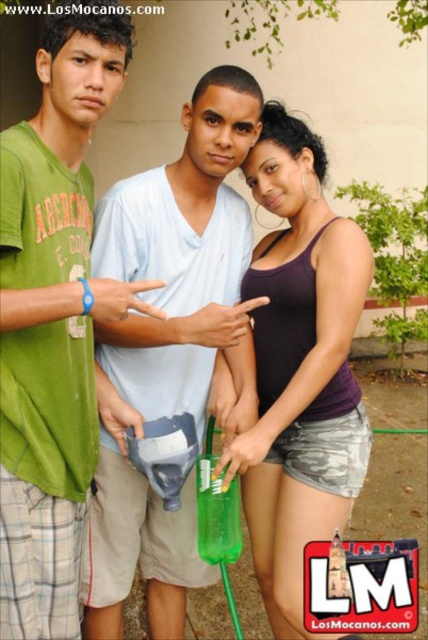
Can you confirm if light blue cotton shirt at center is smaller than purple matte tank top at center?

No.

Between light blue cotton shirt at center and purple matte tank top at center, which one has less height?

Standing shorter between the two is purple matte tank top at center.

Is point (196, 392) in front of point (306, 497)?

No, (196, 392) is further to viewer.

Find the location of a particular element. light blue cotton shirt at center is located at coordinates (184, 259).

Does green fabric shirt at left have a smaller size compared to light blue cotton shirt at center?

Yes, green fabric shirt at left is smaller than light blue cotton shirt at center.

Is green fabric shirt at left to the right of light blue cotton shirt at center from the viewer's perspective?

In fact, green fabric shirt at left is to the left of light blue cotton shirt at center.

You are a GUI agent. You are given a task and a screenshot of the screen. Output one action in this format:
    pyautogui.click(x=<x>, y=<y>)
    Task: Click on the green fabric shirt at left
    The width and height of the screenshot is (428, 640).
    Given the screenshot: What is the action you would take?
    pyautogui.click(x=55, y=324)

Is green fabric shirt at left shorter than purple matte tank top at center?

Correct, green fabric shirt at left is not as tall as purple matte tank top at center.

Who is lower down, green fabric shirt at left or purple matte tank top at center?

Positioned lower is purple matte tank top at center.

Is point (50, 605) behind point (265, 278)?

No.

You are a GUI agent. You are given a task and a screenshot of the screen. Output one action in this format:
    pyautogui.click(x=<x>, y=<y>)
    Task: Click on the green fabric shirt at left
    
    Given the screenshot: What is the action you would take?
    pyautogui.click(x=55, y=324)